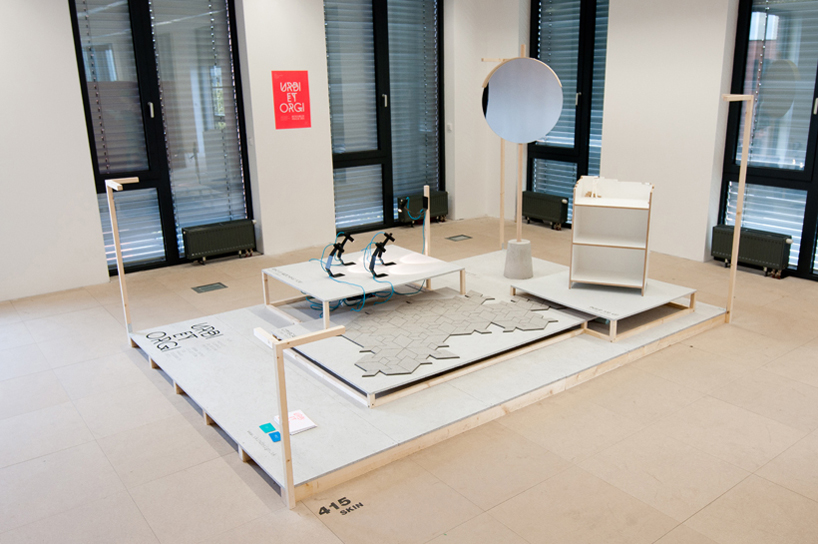
This screenshot has height=544, width=818. Identify the location of smaller glass panels. (149, 219), (370, 184), (551, 173), (785, 206).